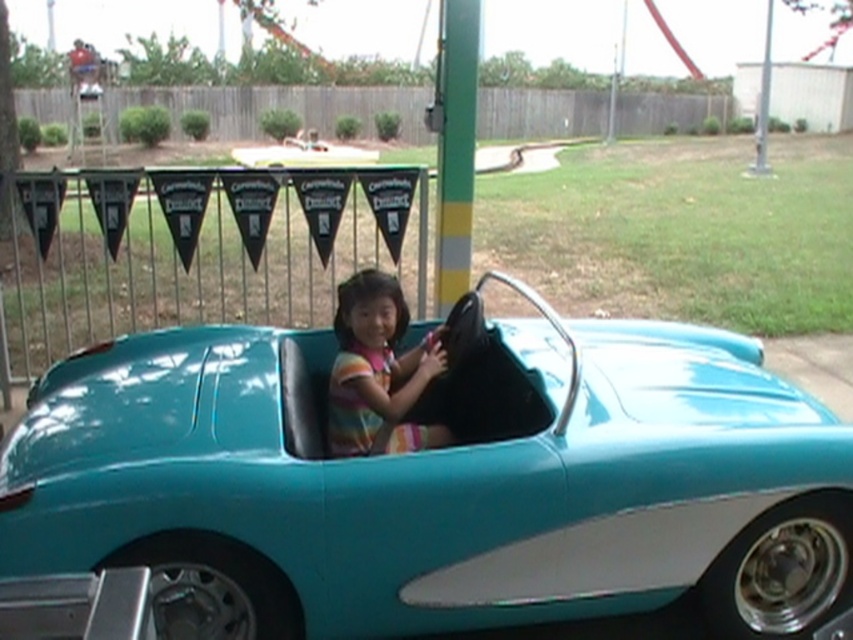
You are a park designer planning to install a new ride. You need to place a new ride sign exactly 0.5 meters to the left of the teal glossy car at center. What are the coordinates where you should place the sign?

The coordinates for the new ride sign should be calculated by subtracting 0.5 meters from the x coordinate of the teal glossy car at center. Since the car is at point (x=419, y=483), the new coordinates would be approximately (x=419, y=163). However, this assumes that the coordinate system is in meters and that the x and y axes are aligned with the left and downward directions respectively. Without specific information about the coordinate system, an exact answer cannot be provided.

You are a photographer trying to capture the teal glossy car at center and the striped fabric child at center in a single shot. Based on their positions, which object should you focus on first to ensure both are in frame?

The teal glossy car at center is in front of the striped fabric child at center, so you should focus on the teal glossy car at center first to ensure both are in frame.

You are a photographer at the carnival. You want to take a picture of the teal glossy car at center and the striped fabric child at center. Which object should you focus on first if you want to capture both in the frame without moving the camera?

The teal glossy car at center is bigger than the striped fabric child at center, so you should focus on the teal glossy car at center first to ensure it fills the frame appropriately before adjusting for the smaller child.